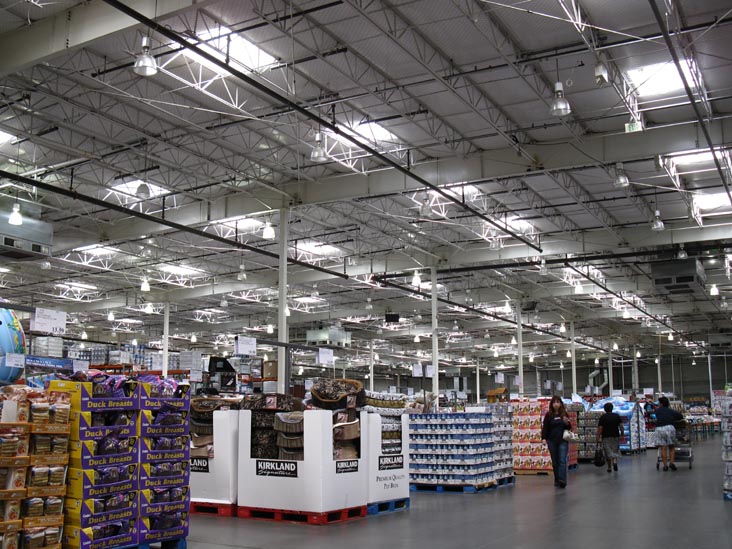
At what (x,y) coordinates should I click in order to perform the action: click on ventilation units. Please return your answer as a coordinate pair (x, y). This screenshot has height=549, width=732. Looking at the image, I should click on (720, 343), (679, 278), (10, 249).